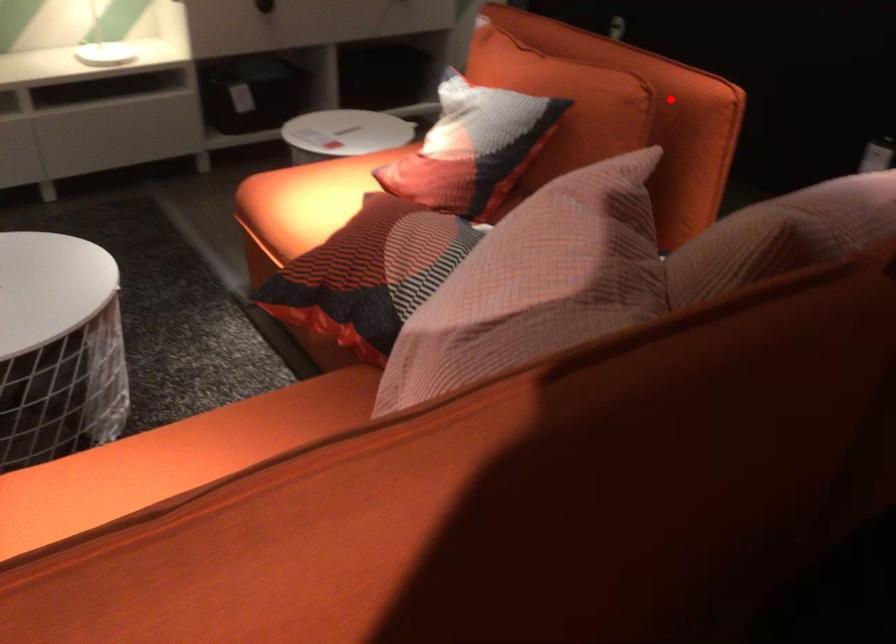
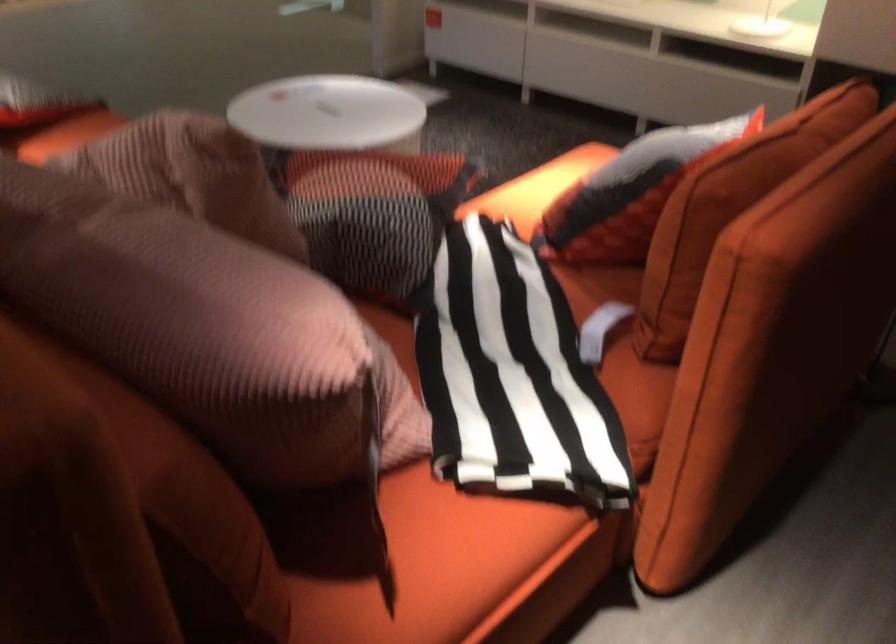
Question: A red point is marked in image1. In image2, is the corresponding 3D point closer to the camera or farther? Reply with the corresponding letter.

Choices:
 (A) The corresponding 3D point is closer.
 (B) The corresponding 3D point is farther.

Answer: (A)